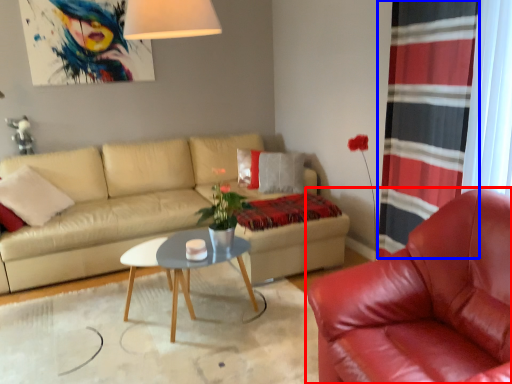
Question: Which object is closer to the camera taking this photo, chair (highlighted by a red box) or curtain (highlighted by a blue box)?

Choices:
 (A) chair
 (B) curtain

Answer: (A)